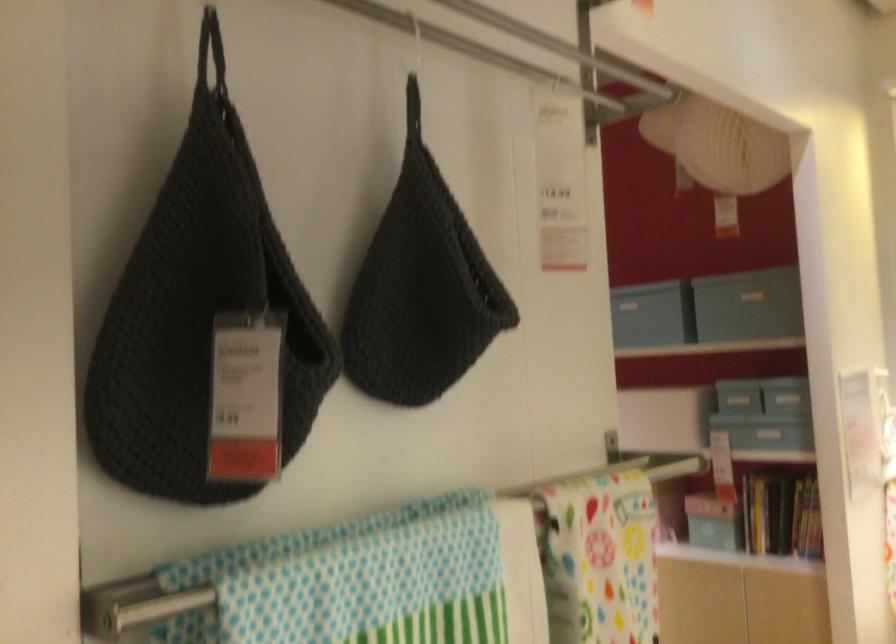
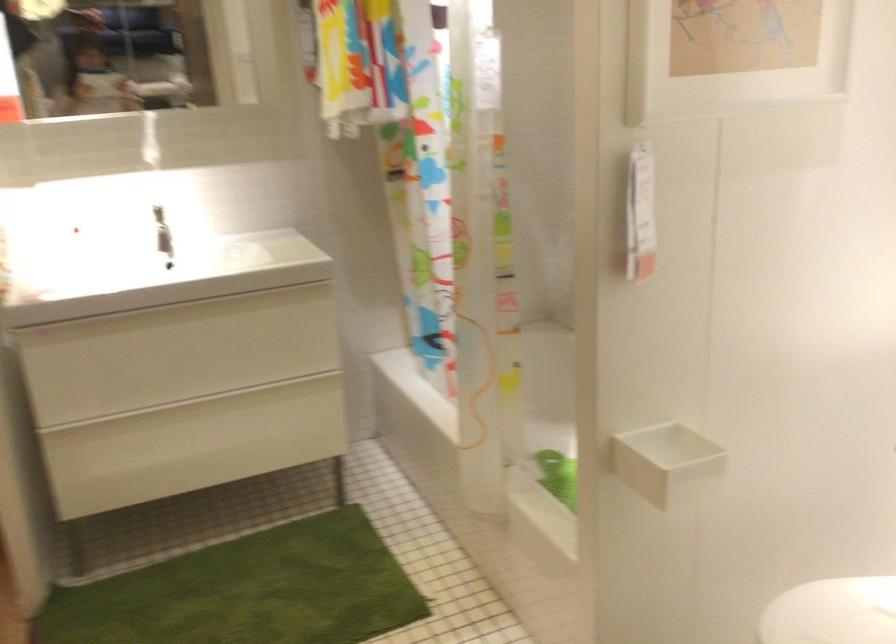
The images are taken continuously from a first-person perspective. In which direction is your viewpoint rotating?

The rotation direction of the camera is right-down.